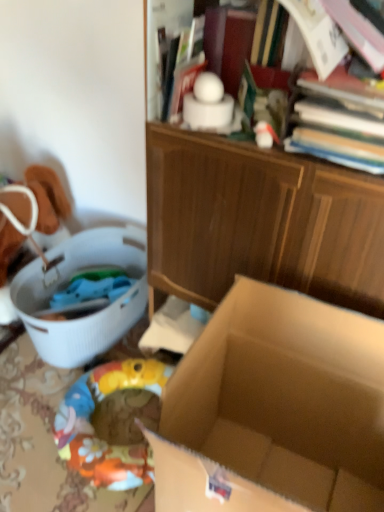
The image size is (384, 512). I want to click on white plastic laundry basket at left, so pyautogui.click(x=87, y=314).

What is the approximate height of hardcover book at upper right?

It is 6.07 inches.

Measure the distance between point (362, 95) and camera.

Point (362, 95) is 33.98 inches from camera.

Image resolution: width=384 pixels, height=512 pixels. Identify the location of white plastic laundry basket at left. (87, 314).

From the image's perspective, is white plastic laundry basket at left positioned above or below hardcover book at upper right?

white plastic laundry basket at left is below hardcover book at upper right.

How many degrees apart are the facing directions of white plastic laundry basket at left and hardcover book at upper right?

white plastic laundry basket at left and hardcover book at upper right are facing 0.836 degrees away from each other.

Between white plastic laundry basket at left and hardcover book at upper right, which one has more height?

Standing taller between the two is white plastic laundry basket at left.

In the image, is white plastic laundry basket at left positioned in front of or behind hardcover book at upper right?

Clearly, white plastic laundry basket at left is behind hardcover book at upper right.

Considering the sizes of objects white plastic laundry basket at left and brown cardboard box at center in the image provided, who is bigger, white plastic laundry basket at left or brown cardboard box at center?

With larger size is brown cardboard box at center.

The image size is (384, 512). In the image, there is a brown cardboard box at center. Find the location of `laundry basket above it (from the image's perspective)`. laundry basket above it (from the image's perspective) is located at coordinates (87, 314).

From the image's perspective, is white plastic laundry basket at left located beneath brown cardboard box at center?

No, from the image's perspective, white plastic laundry basket at left is not below brown cardboard box at center.

Does brown cardboard box at center contain white plastic laundry basket at left?

No, white plastic laundry basket at left is not a part of brown cardboard box at center.

How distant is brown cardboard box at center from white plastic laundry basket at left?

They are 25.96 inches apart.

Is brown cardboard box at center far away from white plastic laundry basket at left?

Actually, brown cardboard box at center and white plastic laundry basket at left are a little close together.

Considering the relative sizes of brown cardboard box at center and white plastic laundry basket at left in the image provided, is brown cardboard box at center taller than white plastic laundry basket at left?

Indeed, brown cardboard box at center has a greater height compared to white plastic laundry basket at left.

Considering the relative sizes of hardcover book at upper right and brown cardboard box at center in the image provided, is hardcover book at upper right bigger than brown cardboard box at center?

No.

Does hardcover book at upper right have a lesser width compared to brown cardboard box at center?

Yes, hardcover book at upper right is thinner than brown cardboard box at center.

Considering the positions of objects hardcover book at upper right and brown cardboard box at center in the image provided, who is more to the left, hardcover book at upper right or brown cardboard box at center?

brown cardboard box at center.

Is hardcover book at upper right far away from brown cardboard box at center?

No, there isn't a large distance between hardcover book at upper right and brown cardboard box at center.

Would you say hardcover book at upper right is a long distance from white plastic laundry basket at left?

No, hardcover book at upper right is not far away from white plastic laundry basket at left.

From a real-world perspective, relative to white plastic laundry basket at left, is hardcover book at upper right vertically above or below?

In terms of real-world spatial position, hardcover book at upper right is above white plastic laundry basket at left.

Is hardcover book at upper right at the left side of white plastic laundry basket at left?

Incorrect, hardcover book at upper right is not on the left side of white plastic laundry basket at left.

Is hardcover book at upper right completely or partially outside of white plastic laundry basket at left?

Indeed, hardcover book at upper right is completely outside white plastic laundry basket at left.

Is brown cardboard box at center oriented towards hardcover book at upper right?

No.

How different are the orientations of brown cardboard box at center and hardcover book at upper right in degrees?

The angle between the facing direction of brown cardboard box at center and the facing direction of hardcover book at upper right is 2.47 degrees.

This screenshot has height=512, width=384. What are the coordinates of `box below the hardcover book at upper right (from a real-world perspective)` in the screenshot? It's located at (274, 409).

Locate an element on the screen. The width and height of the screenshot is (384, 512). laundry basket behind the hardcover book at upper right is located at coordinates (87, 314).

Where is `box above the white plastic laundry basket at left (from a real-world perspective)`? The width and height of the screenshot is (384, 512). box above the white plastic laundry basket at left (from a real-world perspective) is located at coordinates (274, 409).

When comparing their distances from brown cardboard box at center, does white plastic laundry basket at left or hardcover book at upper right seem closer?

hardcover book at upper right is positioned closer to the anchor brown cardboard box at center.

From the image, which object appears to be farther from white plastic laundry basket at left, brown cardboard box at center or hardcover book at upper right?

Based on the image, hardcover book at upper right appears to be further to white plastic laundry basket at left.

From the image, which object appears to be farther from hardcover book at upper right, white plastic laundry basket at left or brown cardboard box at center?

white plastic laundry basket at left lies further to hardcover book at upper right than the other object.

Based on the photo, which object lies nearer to the anchor point hardcover book at upper right, brown cardboard box at center or white plastic laundry basket at left?

The object closer to hardcover book at upper right is brown cardboard box at center.

When comparing their distances from white plastic laundry basket at left, does hardcover book at upper right or brown cardboard box at center seem closer?

Among the two, brown cardboard box at center is located nearer to white plastic laundry basket at left.

Which object lies nearer to the anchor point brown cardboard box at center, hardcover book at upper right or white plastic laundry basket at left?

hardcover book at upper right lies closer to brown cardboard box at center than the other object.

Image resolution: width=384 pixels, height=512 pixels. What are the coordinates of `box between white plastic laundry basket at left and hardcover book at upper right from left to right` in the screenshot? It's located at (274, 409).